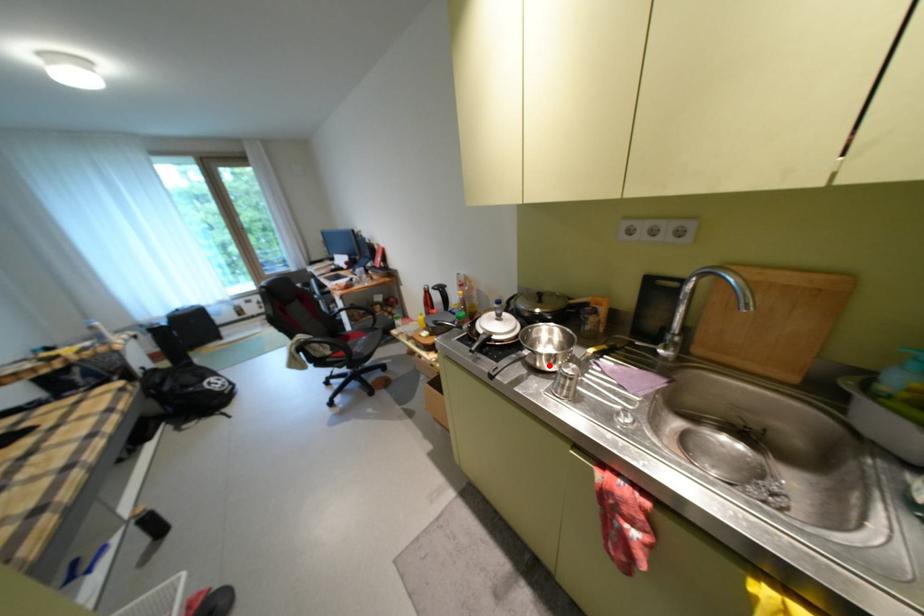
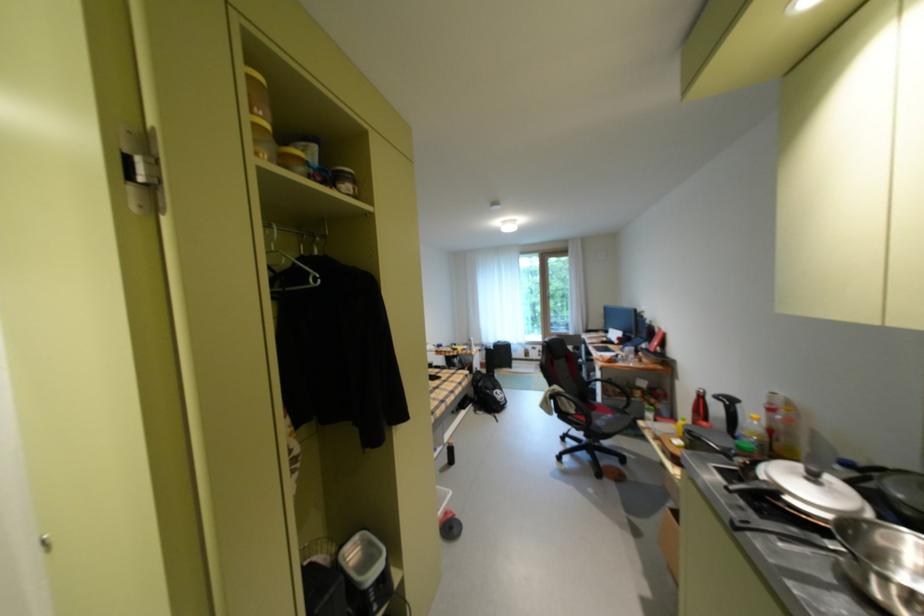
Question: I am providing you with two images of the same scene from different viewpoints. A red point is marked on the first image. Is the red point's position out of view in image 2?

Choices:
 (A) Yes
 (B) No

Answer: (B)